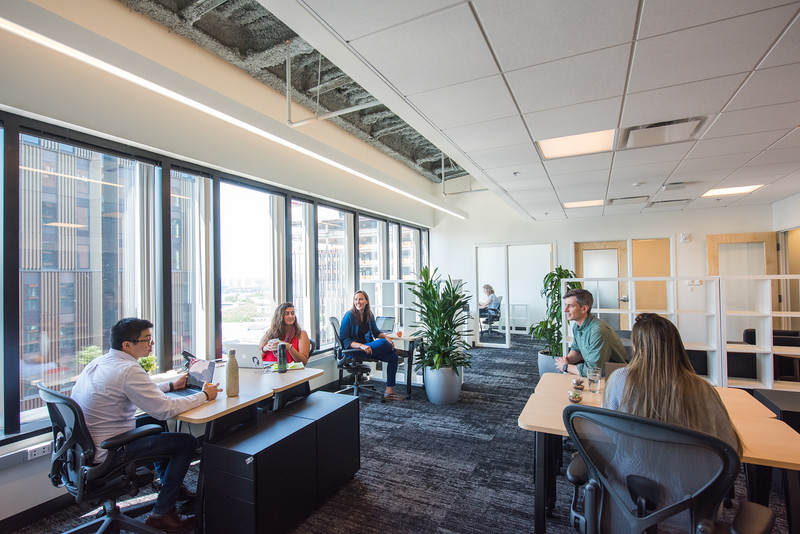
Where is `lights`? This screenshot has width=800, height=534. lights is located at coordinates (572, 140), (577, 203), (725, 188), (318, 153).